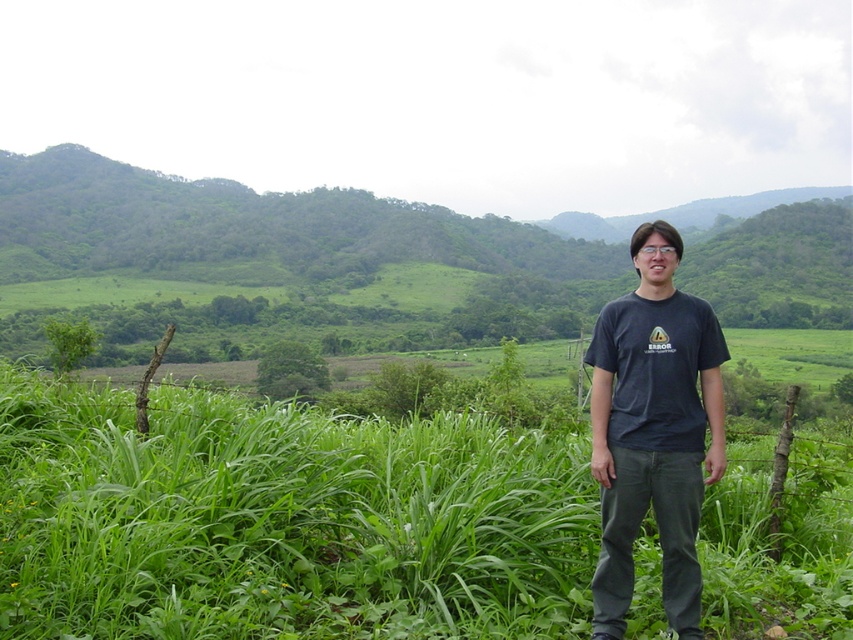
Question: Does green grass at center appear on the left side of dark gray t-shirt at center?

Choices:
 (A) no
 (B) yes

Answer: (A)

Question: Does green grass at center lie in front of dark gray t-shirt at center?

Choices:
 (A) yes
 (B) no

Answer: (B)

Question: Which point is farther to the camera?

Choices:
 (A) (714, 323)
 (B) (51, 449)

Answer: (B)

Question: Can you confirm if green grass at center is bigger than dark gray t-shirt at center?

Choices:
 (A) yes
 (B) no

Answer: (A)